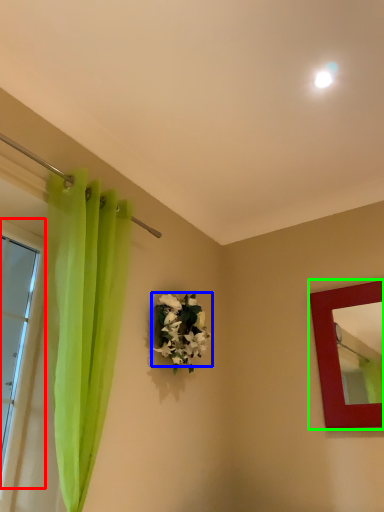
Question: Which object is the farthest from window (highlighted by a red box)? Choose among these: flower (highlighted by a blue box) or picture frame (highlighted by a green box).

Choices:
 (A) flower
 (B) picture frame

Answer: (B)